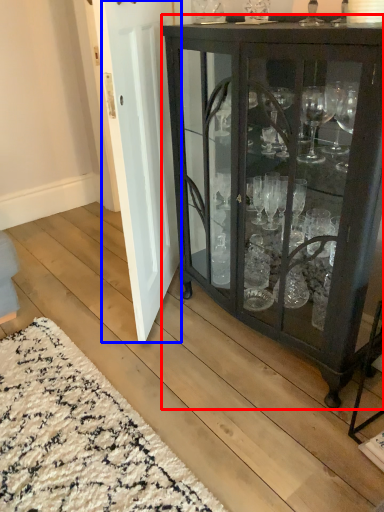
Question: Among these objects, which one is nearest to the camera, cupboard (highlighted by a red box) or door (highlighted by a blue box)?

Choices:
 (A) cupboard
 (B) door

Answer: (A)